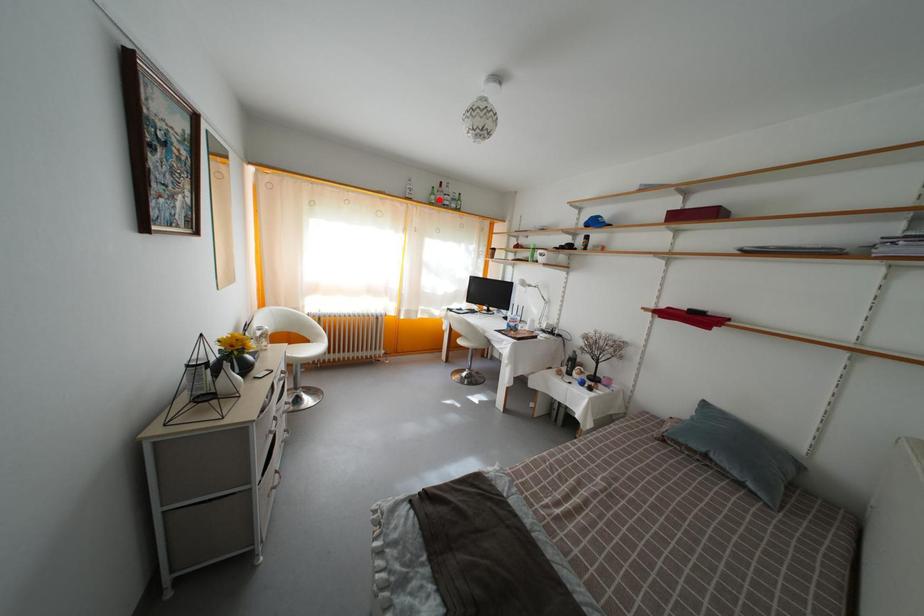
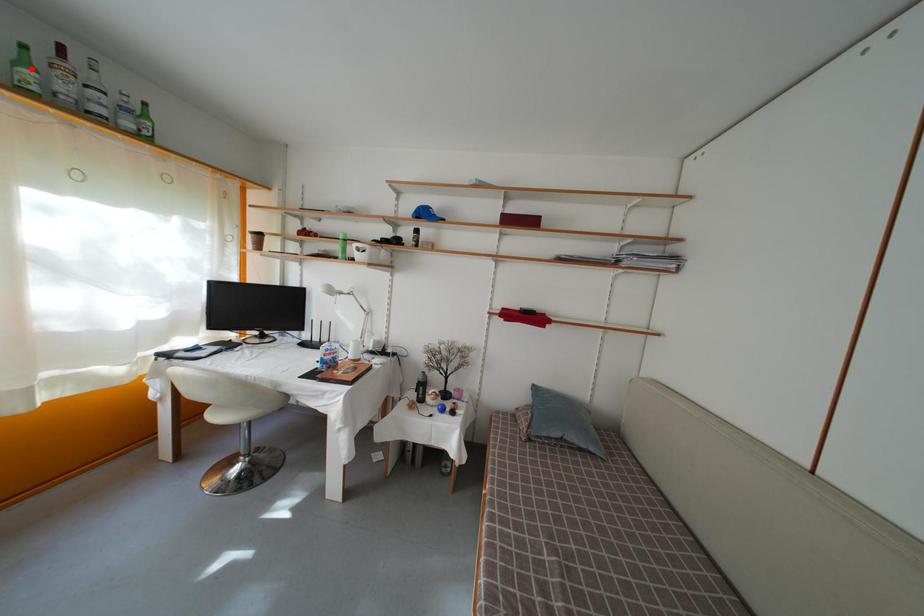
I am providing you with two images of the same scene from different viewpoints. A red point is marked on the first image and another point is marked on the second image. Do the highlighted points in image1 and image2 indicate the same real-world spot?

Yes